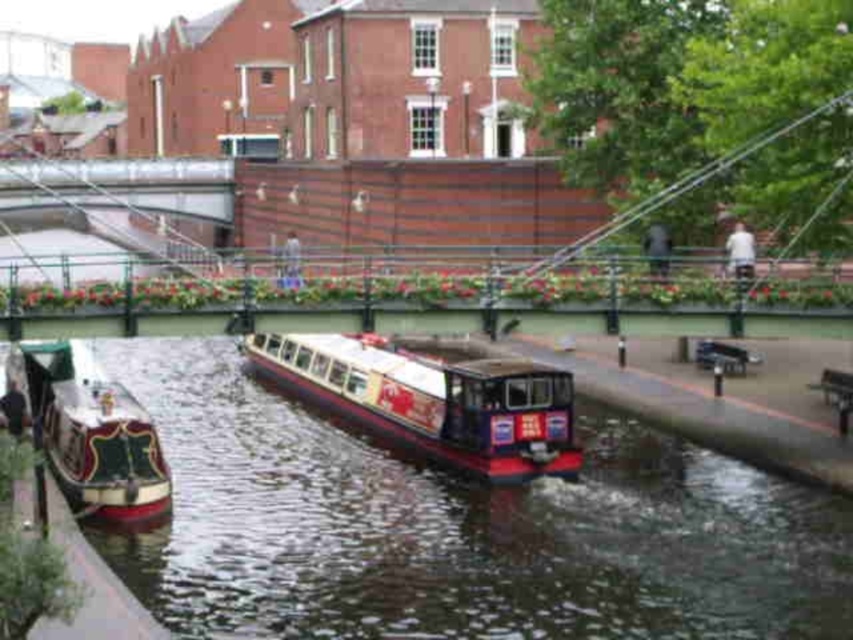
Question: Which point is closer to the camera taking this photo?

Choices:
 (A) coord(103,480)
 (B) coord(584,500)

Answer: (A)

Question: Can you confirm if smooth dark water at center is bigger than polished wood boat at lower left?

Choices:
 (A) no
 (B) yes

Answer: (B)

Question: Is smooth dark water at center above shiny metallic boat at center?

Choices:
 (A) no
 (B) yes

Answer: (B)

Question: Does shiny metallic boat at center appear on the left side of polished wood boat at lower left?

Choices:
 (A) yes
 (B) no

Answer: (B)

Question: Which is farther from the smooth dark water at center?

Choices:
 (A) shiny metallic boat at center
 (B) polished wood boat at lower left

Answer: (B)

Question: Estimate the real-world distances between objects in this image. Which object is closer to the shiny metallic boat at center?

Choices:
 (A) smooth dark water at center
 (B) polished wood boat at lower left

Answer: (A)